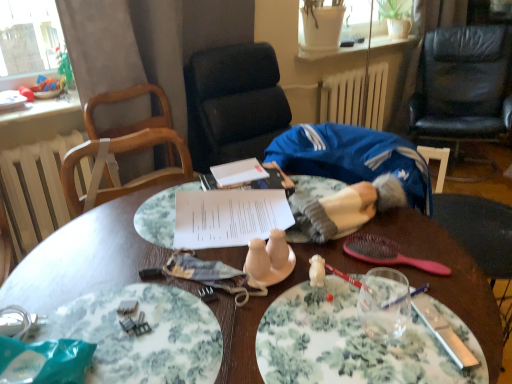
Image resolution: width=512 pixels, height=384 pixels. Find the location of `free space between floral ceramic plate at center, marked as the first plate in a right-to-left arrangement, and pink plastic spoon at lower right`. free space between floral ceramic plate at center, marked as the first plate in a right-to-left arrangement, and pink plastic spoon at lower right is located at coordinates (438, 294).